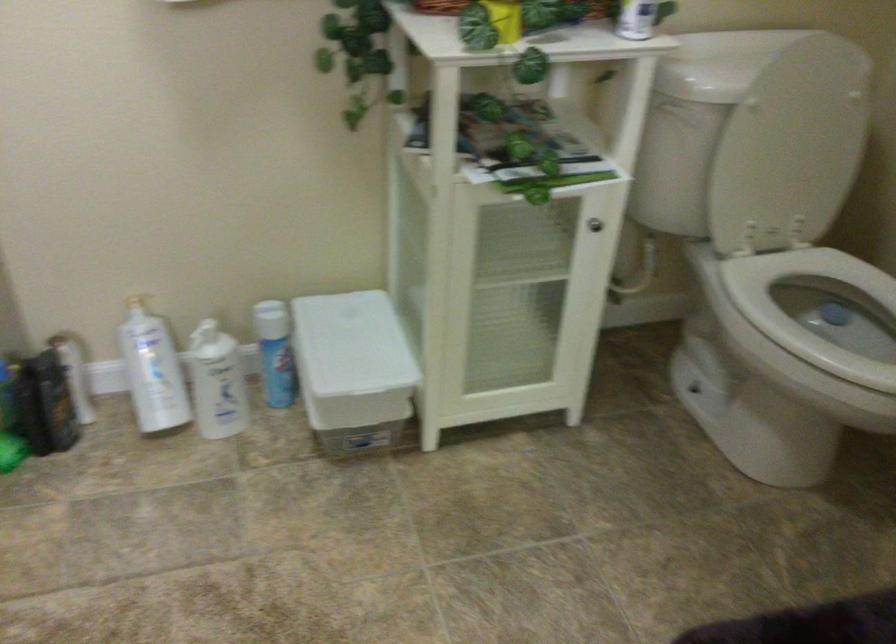
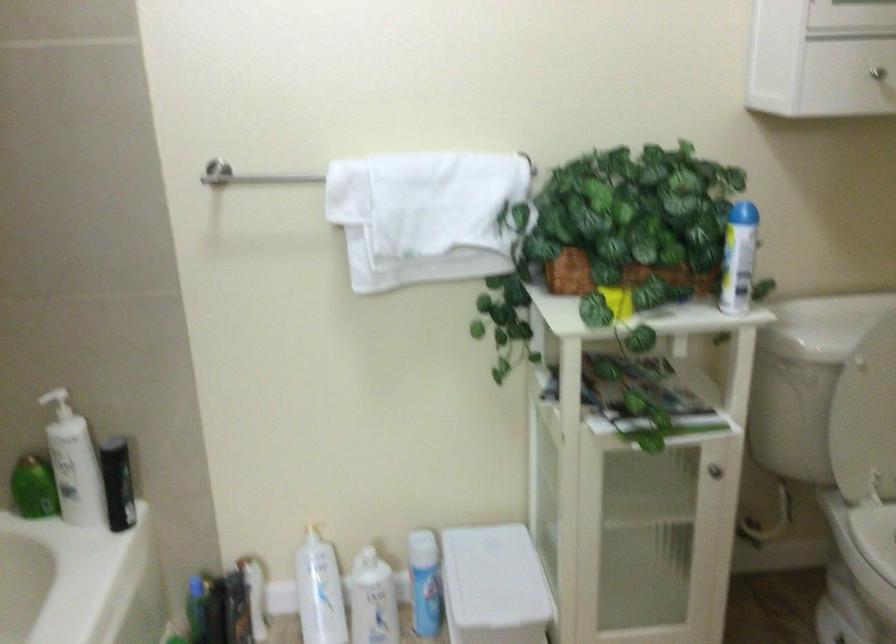
Question: The images are taken continuously from a first-person perspective. In which direction are you moving?

Choices:
 (A) Left
 (B) Right
 (C) Forward
 (D) Backward

Answer: (D)